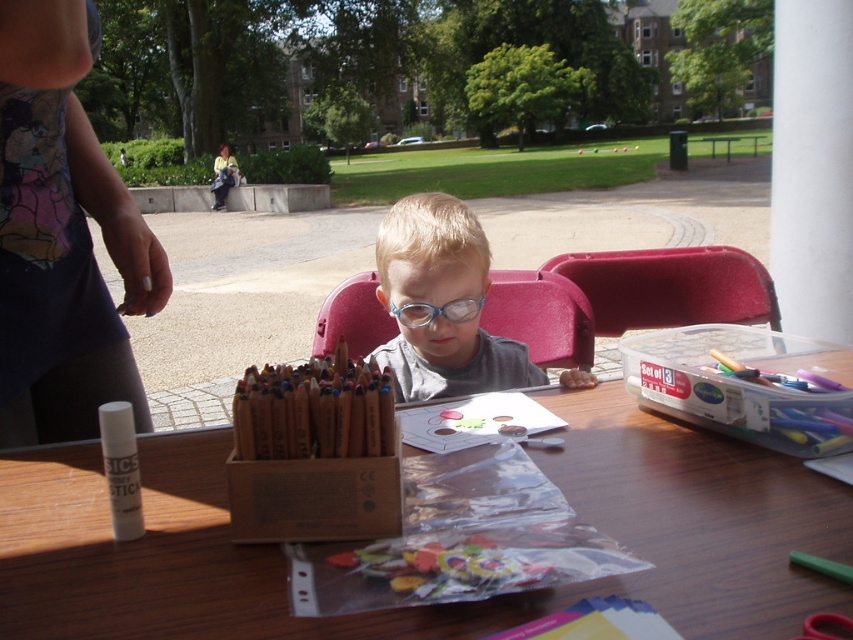
Who is higher up, matte plastic child at center or blue plastic glasses at center?

Positioned higher is blue plastic glasses at center.

What do you see at coordinates (440, 304) in the screenshot?
I see `matte plastic child at center` at bounding box center [440, 304].

The height and width of the screenshot is (640, 853). Identify the location of matte plastic child at center. (440, 304).

This screenshot has height=640, width=853. What are the coordinates of `matte plastic child at center` in the screenshot? It's located at (440, 304).

Between matte plastic child at center and white matte glue stick at lower left, which one is positioned higher?

matte plastic child at center is above.

Is point (498, 356) positioned before point (123, 451)?

No, it is behind (123, 451).

Is point (450, 356) closer to viewer compared to point (120, 419)?

No, (450, 356) is further to viewer.

This screenshot has width=853, height=640. I want to click on matte plastic child at center, so click(440, 304).

Is the position of wooden at center more distant than that of matte plastic child at center?

No, it is in front of matte plastic child at center.

Can you confirm if wooden at center is thinner than matte plastic child at center?

In fact, wooden at center might be wider than matte plastic child at center.

Does point (160, 579) lie in front of point (471, 253)?

Yes, it is.

This screenshot has width=853, height=640. I want to click on wooden at center, so click(433, 605).